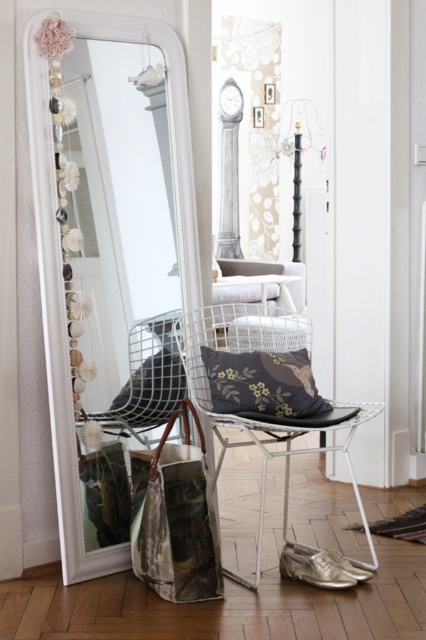
You are a delivery person who needs to place a package between the white glossy mirror at center and the white wire stool at center. The package requires a minimum of 2 meters of space to be placed safely. Can you fit the package there?

The distance between the white glossy mirror at center and the white wire stool at center is 2.01 meters, so yes, the package can be safely placed there as it meets the minimum requirement.